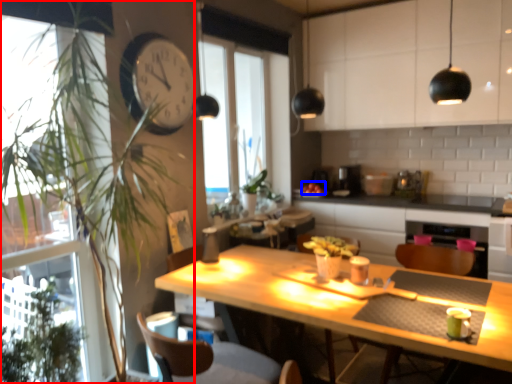
Question: Which point is closer to the camera, houseplant (highlighted by a red box) or fruit (highlighted by a blue box)?

Choices:
 (A) houseplant
 (B) fruit

Answer: (A)